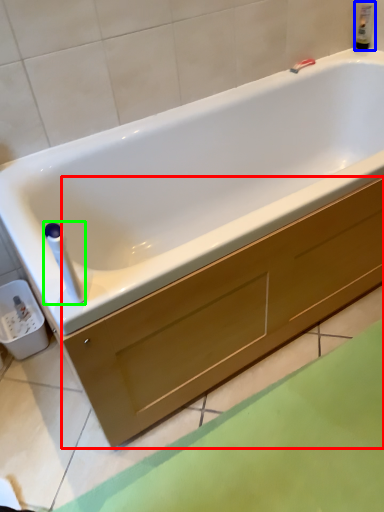
Question: Considering the real-world distances, which object is closest to drawer (highlighted by a red box)? bottle (highlighted by a blue box) or towel bar (highlighted by a green box).

Choices:
 (A) bottle
 (B) towel bar

Answer: (B)